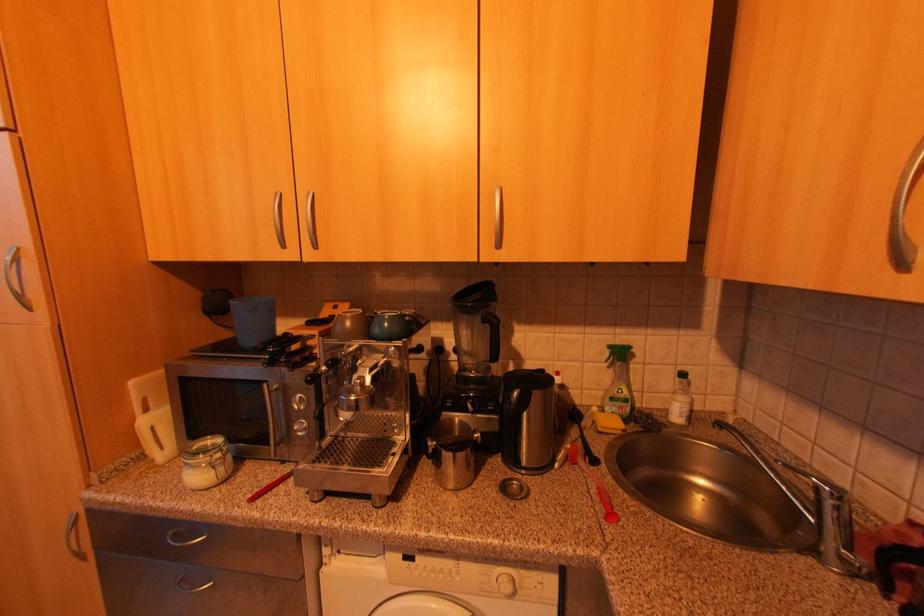
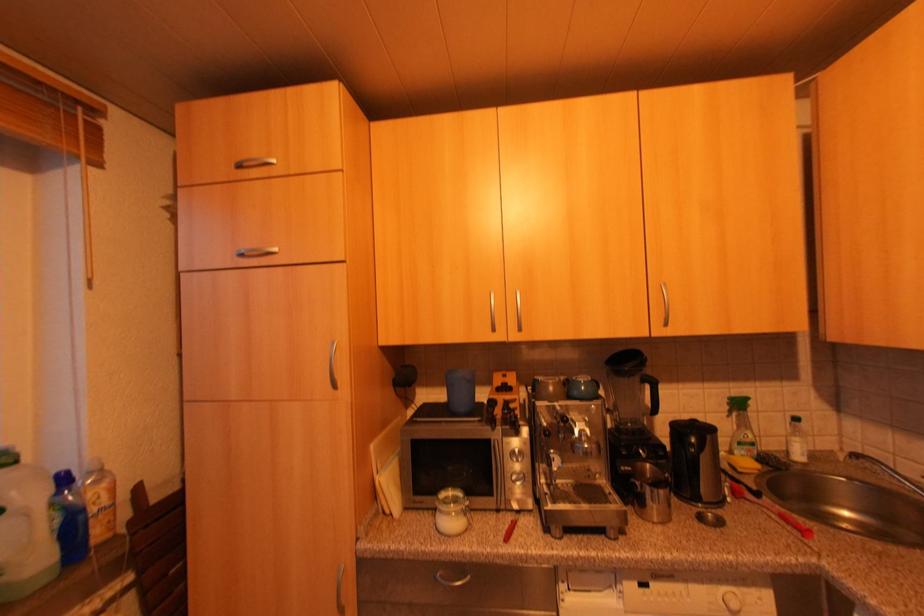
Question: Based on the continuous images, in which direction is the camera rotating? Reply with the corresponding letter.

Choices:
 (A) Left
 (B) Right
 (C) Up
 (D) Down

Answer: (C)